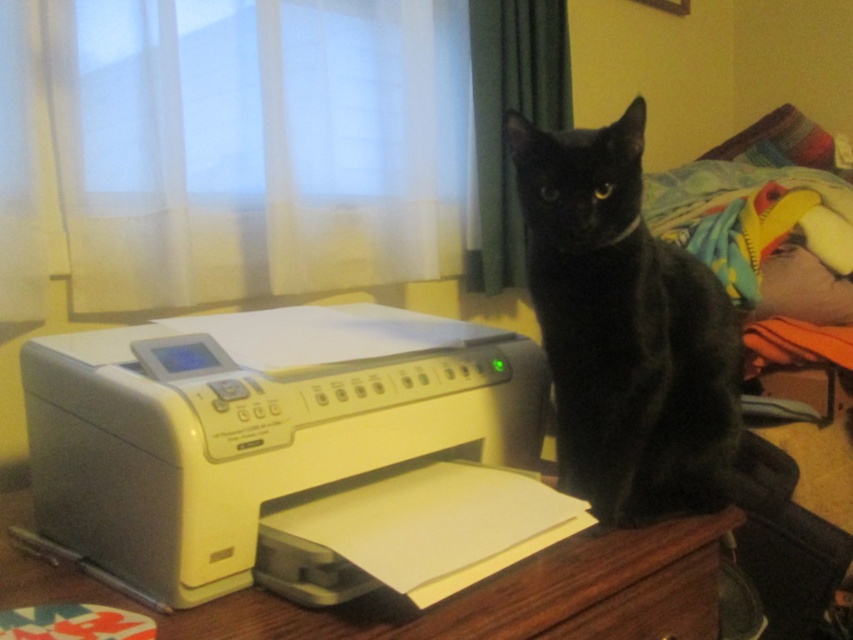
From the picture: You are organizing a workspace and need to place a new lamp between the wooden table at center and the wooden drawer at lower center. Based on their positions, where should you place the lamp?

The wooden table at center is to the left of the wooden drawer at lower center, so you should place the lamp between them on the right side of the wooden table at center and the left side of the wooden drawer at lower center.

You are a delivery person who needs to place a small package on the wooden table at center without moving the white plastic printer at lower left. Can you fit the package on the table?

The white plastic printer at lower left is 6.66 inches from the wooden table at center. Since the distance between them is only 6.66 inches, the package might not fit comfortably unless it is very small. However, the question states not to move the printer, so you can try placing the package on the remaining space of the wooden table at center.

You are organizing a space for a new pet cat. You have a wooden table at center and a black glossy cat at center. Which object is smaller in size?

The black glossy cat at center is smaller in size compared to the wooden table at center.